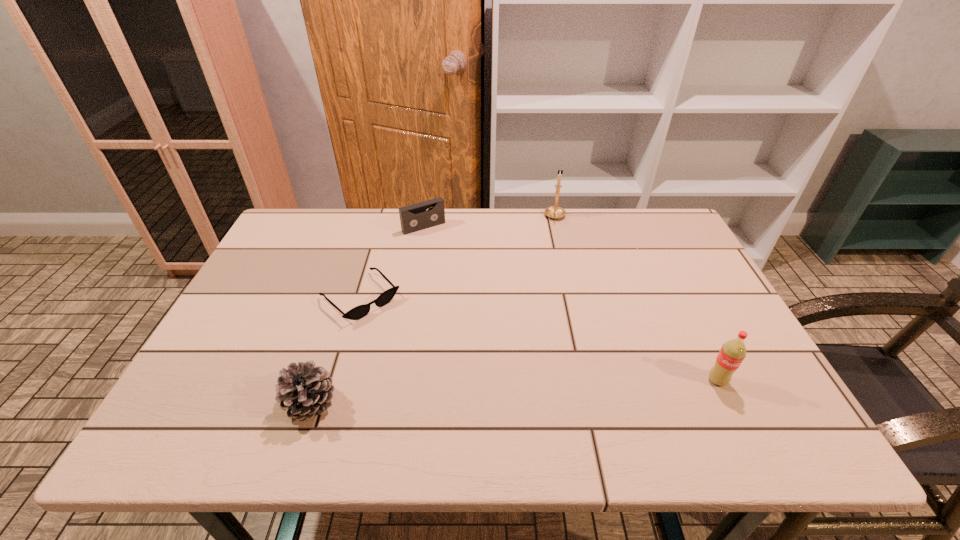
I want to click on vacant space that is in between the fourth tallest object and the soda, so click(x=570, y=304).

I want to click on free space that is in between the rightmost object and the second object from right to left, so click(x=636, y=299).

At what (x,y) coordinates should I click in order to perform the action: click on free spot between the videotape and the candle holder. Please return your answer as a coordinate pair (x, y). The height and width of the screenshot is (540, 960). Looking at the image, I should click on (490, 222).

Locate an element on the screen. The width and height of the screenshot is (960, 540). blank region between the third nearest object and the third shortest object is located at coordinates 335,350.

Locate an element on the screen. free area in between the videotape and the pinecone is located at coordinates (368, 315).

You are a GUI agent. You are given a task and a screenshot of the screen. Output one action in this format:
    pyautogui.click(x=<x>, y=<y>)
    Task: Click on the unoccupied area between the candle holder and the third nearest object
    
    Given the screenshot: What is the action you would take?
    pyautogui.click(x=458, y=258)

You are a GUI agent. You are given a task and a screenshot of the screen. Output one action in this format:
    pyautogui.click(x=<x>, y=<y>)
    Task: Click on the free space between the second object from right to left and the pinecone
    
    Given the screenshot: What is the action you would take?
    pyautogui.click(x=433, y=310)

Locate an element on the screen. This screenshot has height=540, width=960. empty space between the third shortest object and the shortest object is located at coordinates (335, 350).

The width and height of the screenshot is (960, 540). What are the coordinates of `free space between the third farthest object and the rightmost object` in the screenshot? It's located at (539, 339).

Find the location of a particular element. Image resolution: width=960 pixels, height=540 pixels. vacant space in between the sunglasses and the candle holder is located at coordinates (458, 258).